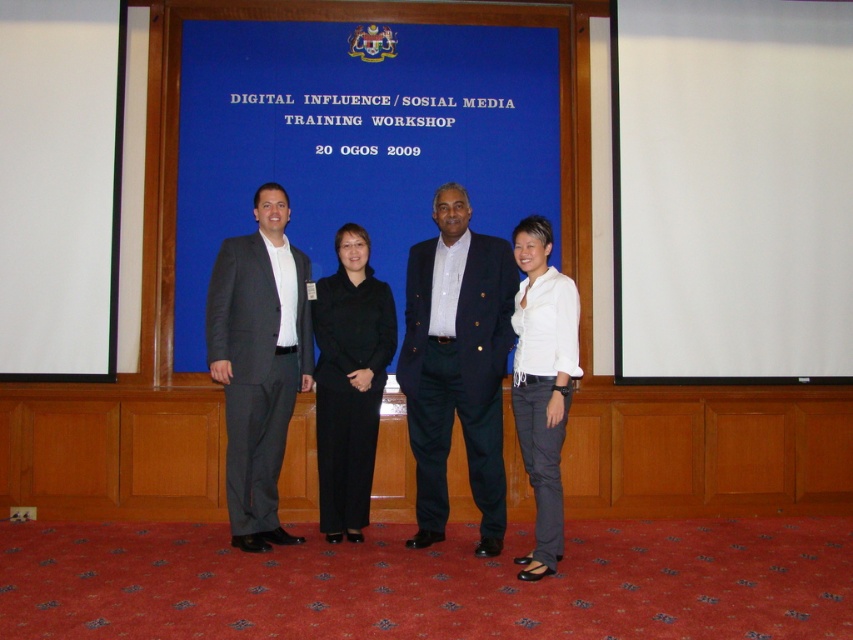
Question: Where is blue matte projection screen at center located in relation to matte gray suit at left in the image?

Choices:
 (A) below
 (B) above

Answer: (B)

Question: Can you confirm if white matte projection screen at right is positioned above black fabric pants at center?

Choices:
 (A) no
 (B) yes

Answer: (B)

Question: Which object is farther from the camera taking this photo?

Choices:
 (A) white matte shirt at center
 (B) white matte projection screen at right
 (C) dark blue blazer at center

Answer: (B)

Question: Among these points, which one is farthest from the camera?

Choices:
 (A) (659, 264)
 (B) (445, 435)

Answer: (A)

Question: Among these points, which one is farthest from the camera?

Choices:
 (A) (808, 234)
 (B) (519, 145)
 (C) (534, 456)
 (D) (238, 506)

Answer: (B)

Question: Where is white matte projection screen at right located in relation to blue matte projection screen at center in the image?

Choices:
 (A) left
 (B) right

Answer: (B)